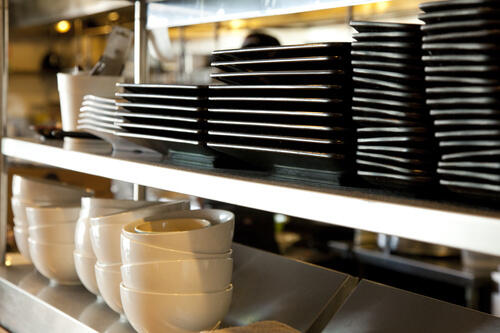
I want to click on white plates, so click(x=102, y=133), click(x=95, y=121), click(x=100, y=118), click(x=91, y=111), click(x=98, y=106), click(x=99, y=97).